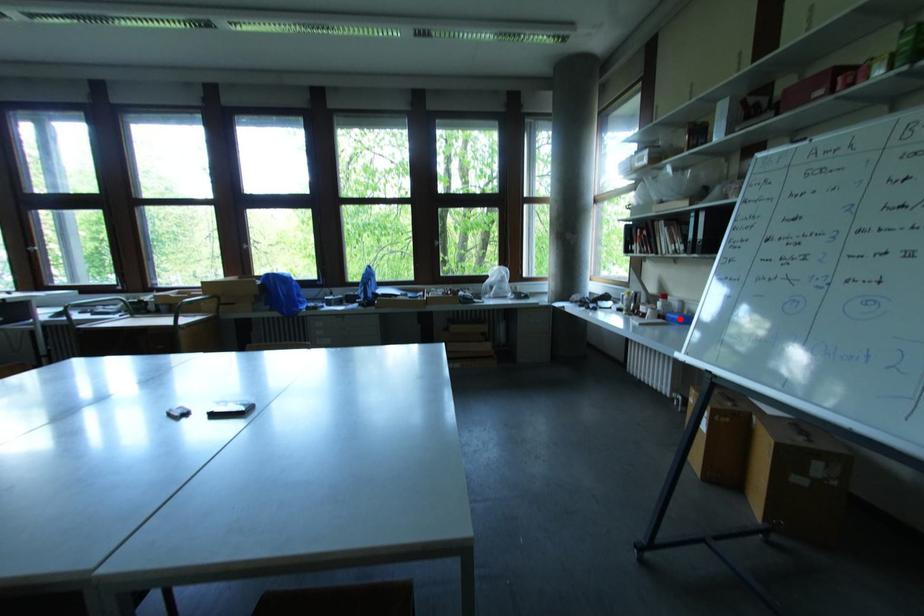
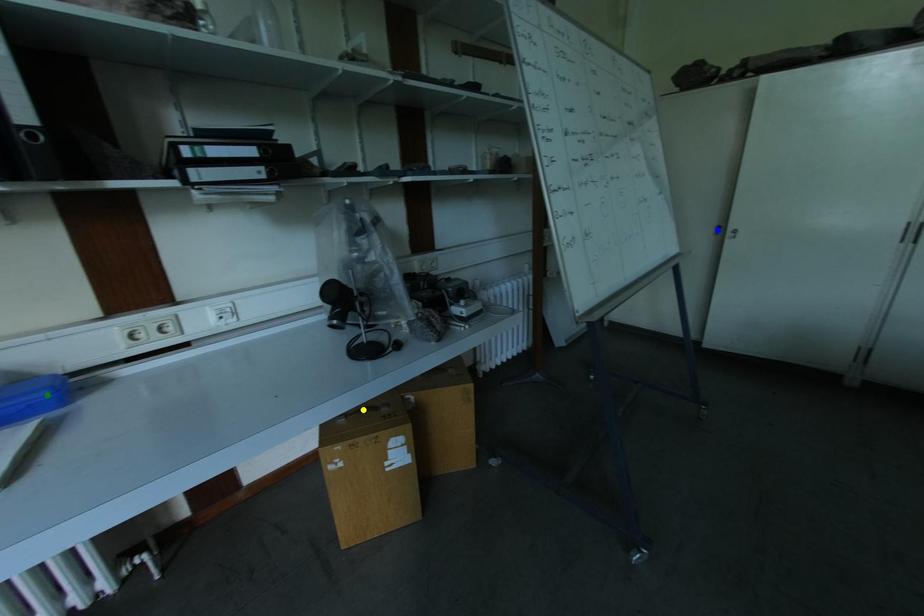
Question: I am providing you with two images of the same scene from different viewpoints. A red point is marked on the first image. You are given multiple points on the second image. Can you choose the point in image 2 that corresponds to the point in image 1?

Choices:
 (A) green point
 (B) yellow point
 (C) blue point

Answer: (A)